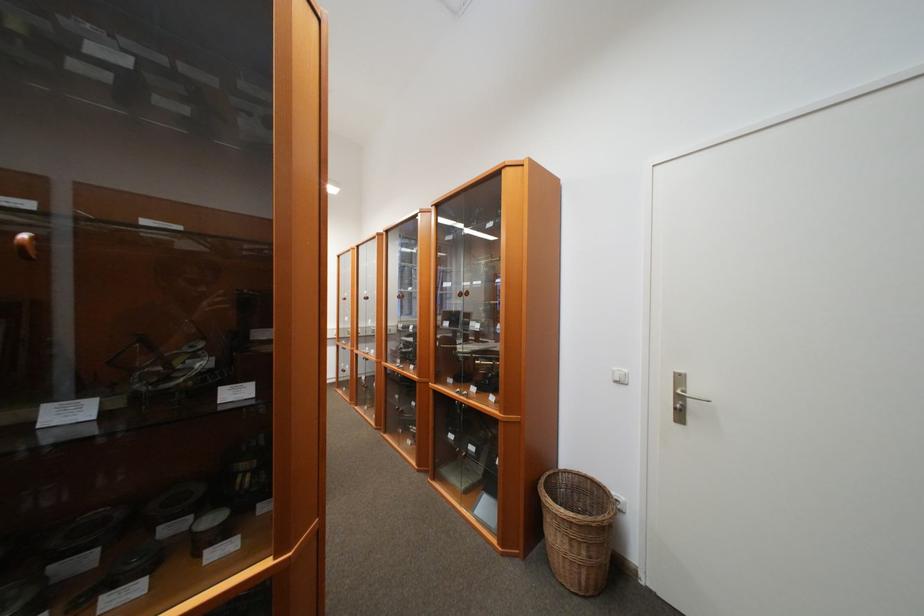
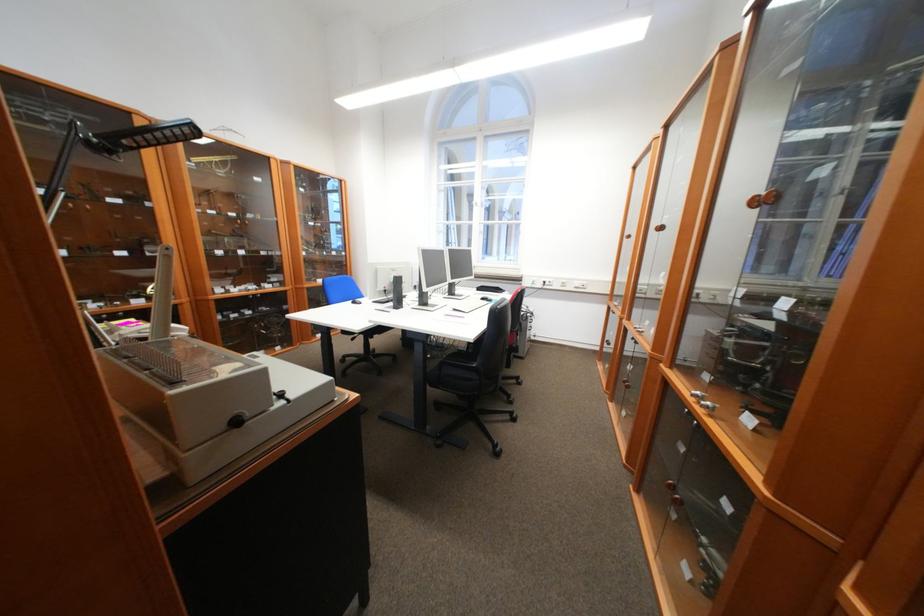
Locate, in the second image, the point that corresponds to point 343,377 in the first image.

(609, 345)